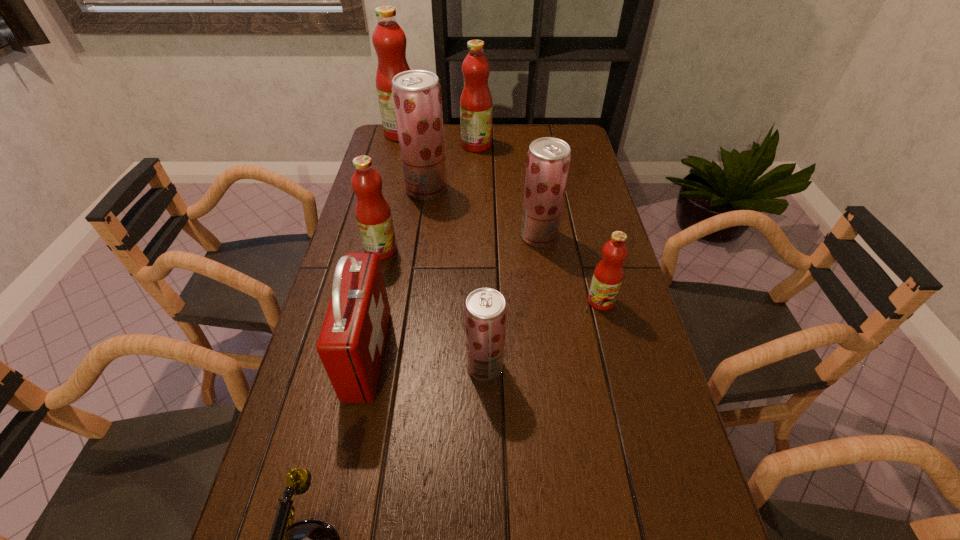
Where is `the rightmost fruit juice`? The image size is (960, 540). the rightmost fruit juice is located at coordinates (608, 274).

Identify the location of the nearest strawberry fruit juice. (485, 309).

Locate an element on the screen. The height and width of the screenshot is (540, 960). the smallest strawberry fruit juice is located at coordinates (485, 309).

At what (x,y) coordinates should I click in order to perform the action: click on free space located 0.300m on the front label of the tallest object. Please return your answer as a coordinate pair (x, y). This screenshot has width=960, height=540. Looking at the image, I should click on (494, 133).

Where is `free space located 0.240m on the front label of the third smallest pink fruit juice`? This screenshot has width=960, height=540. free space located 0.240m on the front label of the third smallest pink fruit juice is located at coordinates (554, 145).

Identify the location of blank space located 0.180m on the front of the leftmost strawberry fruit juice. The width and height of the screenshot is (960, 540). (420, 238).

Where is `vacant region located on the back of the sixth fruit juice from left to right`? The height and width of the screenshot is (540, 960). vacant region located on the back of the sixth fruit juice from left to right is located at coordinates (535, 205).

This screenshot has width=960, height=540. Find the location of `vacant area located on the front label of the third farthest pink fruit juice`. vacant area located on the front label of the third farthest pink fruit juice is located at coordinates (421, 249).

Find the location of a particular element. The image size is (960, 540). vacant space positioned 0.230m on the front face of the red first-aid kit is located at coordinates (482, 354).

You are a GUI agent. You are given a task and a screenshot of the screen. Output one action in this format:
    pyautogui.click(x=<x>, y=<y>)
    Task: Click on the vacant area located on the front label of the sixth farthest object
    
    Given the screenshot: What is the action you would take?
    pyautogui.click(x=612, y=347)